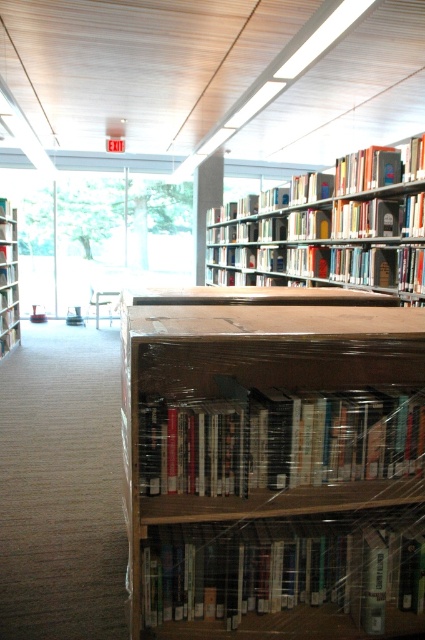
Question: Is clear plastic bookshelf at center to the right of hardcover book at center from the viewer's perspective?

Choices:
 (A) no
 (B) yes

Answer: (A)

Question: Which of these objects is positioned closest to the hardcover book at upper center?

Choices:
 (A) matte plastic books at center
 (B) clear plastic bookcase at upper center
 (C) white glossy book at lower center
 (D) clear plastic bookshelf at center

Answer: (B)

Question: Estimate the real-world distances between objects in this image. Which object is closer to the clear plastic bookcase at upper center?

Choices:
 (A) matte plastic bookcase at left
 (B) hardcover book at upper center
 (C) hardcover book at center

Answer: (B)

Question: Which object appears closest to the camera in this image?

Choices:
 (A) clear plastic bookshelf at center
 (B) hardcover book at upper center
 (C) clear plastic bookcase at upper center
 (D) matte plastic bookcase at left

Answer: (A)

Question: Is hardcover book at upper center closer to the viewer compared to hardcover book at center?

Choices:
 (A) yes
 (B) no

Answer: (B)

Question: Can you confirm if clear plastic bookcase at upper center is thinner than hardcover book at upper center?

Choices:
 (A) no
 (B) yes

Answer: (A)